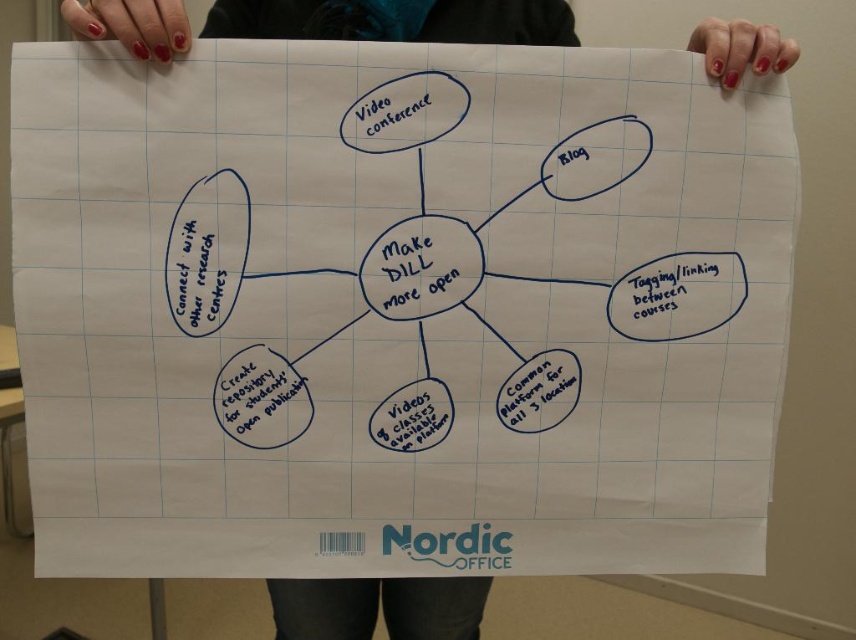
Question: Is the position of black handwritten text at upper right more distant than that of matte blue text at upper center?

Choices:
 (A) yes
 (B) no

Answer: (A)

Question: Is black handwritten text at upper right to the right of black handwritten text at upper left from the viewer's perspective?

Choices:
 (A) no
 (B) yes

Answer: (B)

Question: Which of the following is the farthest from the observer?

Choices:
 (A) matte blue text at upper center
 (B) black handwritten text at upper left
 (C) black handwritten text at upper right

Answer: (C)

Question: Which is nearer to the black handwritten text at upper left?

Choices:
 (A) black handwritten text at upper right
 (B) matte blue text at upper center

Answer: (B)

Question: Can you confirm if black handwritten text at upper right is smaller than matte blue text at upper center?

Choices:
 (A) yes
 (B) no

Answer: (B)

Question: Considering the real-world distances, which object is closest to the black handwritten text at upper left?

Choices:
 (A) black handwritten text at upper right
 (B) matte blue text at upper center

Answer: (B)